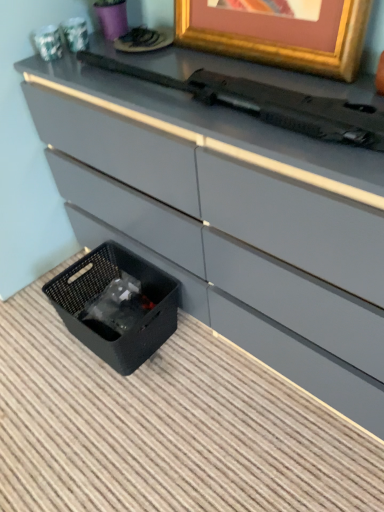
Find the location of `vacant space to the right of black woven basket at lower left`. vacant space to the right of black woven basket at lower left is located at coordinates (208, 355).